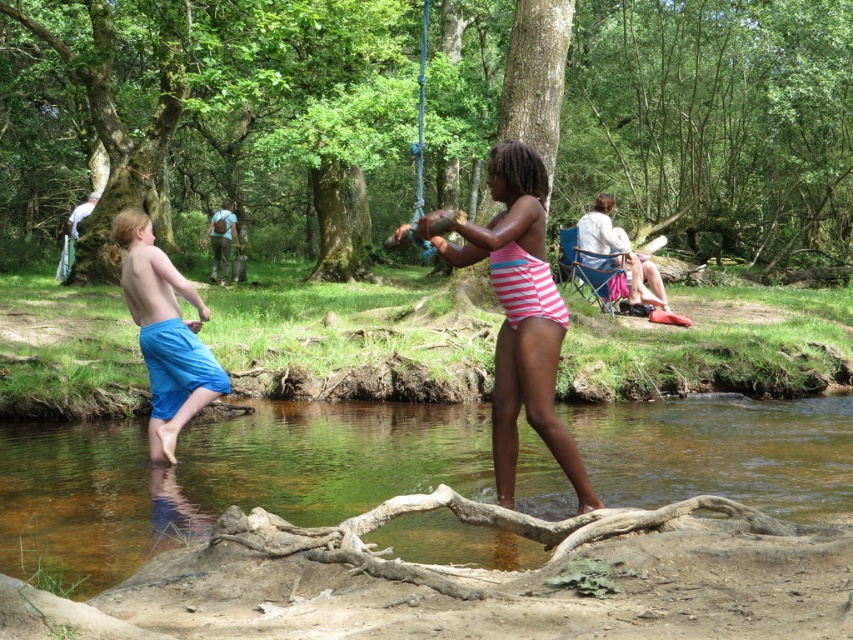
Question: Estimate the real-world distances between objects in this image. Which object is closer to the pink striped swimsuit at center?

Choices:
 (A) clear water at stream center
 (B) blue fabric shorts at left

Answer: (B)

Question: Among these points, which one is farthest from the camera?

Choices:
 (A) (561, 445)
 (B) (160, 308)

Answer: (B)

Question: Can you confirm if pink striped swimsuit at center is wider than blue fabric shorts at left?

Choices:
 (A) no
 (B) yes

Answer: (B)

Question: Estimate the real-world distances between objects in this image. Which object is closer to the clear water at stream center?

Choices:
 (A) pink striped swimsuit at center
 (B) blue fabric shorts at left

Answer: (B)

Question: Does pink striped swimsuit at center appear over blue fabric shorts at left?

Choices:
 (A) no
 (B) yes

Answer: (A)

Question: Does clear water at stream center appear over pink striped swimsuit at center?

Choices:
 (A) no
 (B) yes

Answer: (A)